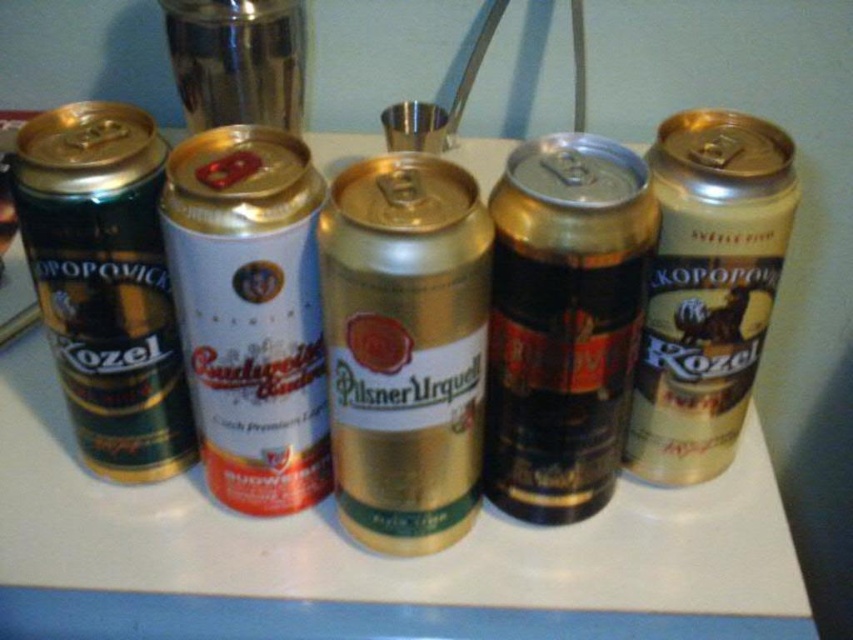
You are standing at the edge of the table where the five beer cans are arranged. You want to pick up the gold metallic can at center without moving any other cans. Is it within your reach if your hand can extend 16 inches forward?

The gold metallic can at center is 15.57 inches away from the viewer. Since your hand can extend 16 inches forward, you can reach it without moving other cans.

You are trying to fit both the white matte can at center and the shiny green can at left into a narrow slot that can only accommodate one can at a time. Which can should you choose to fit first?

The white matte can at center is thinner than the shiny green can at left, so it should be chosen first to fit into the narrow slot since it has a smaller diameter.